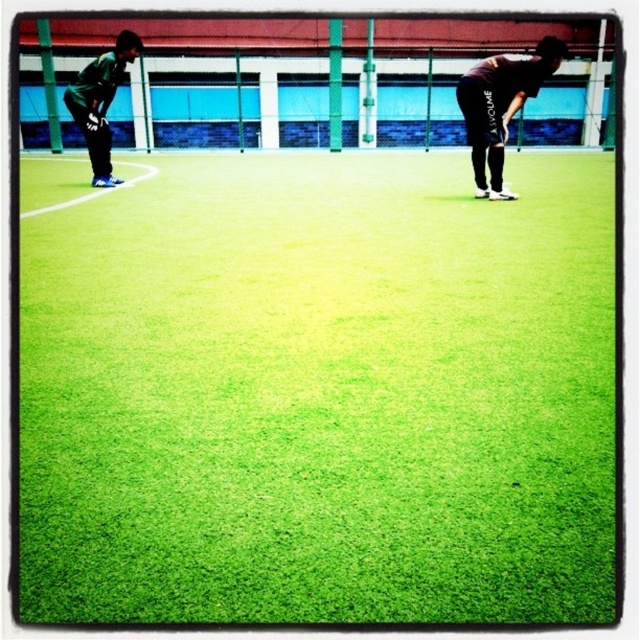
Question: Can you confirm if green artificial turf at center is bigger than black matte shirt at right?

Choices:
 (A) no
 (B) yes

Answer: (B)

Question: Where is green artificial turf at center located in relation to black matte shirt at right in the image?

Choices:
 (A) right
 (B) left

Answer: (B)

Question: Which of the following is the closest to the observer?

Choices:
 (A) black matte shirt at right
 (B) dark green jersey at left

Answer: (A)

Question: Which of these objects is positioned farthest from the black matte shirt at right?

Choices:
 (A) green artificial turf at center
 (B) dark green jersey at left

Answer: (B)

Question: Among these points, which one is farthest from the camera?

Choices:
 (A) (102, 115)
 (B) (524, 93)

Answer: (A)

Question: Is green artificial turf at center below black matte shirt at right?

Choices:
 (A) yes
 (B) no

Answer: (A)